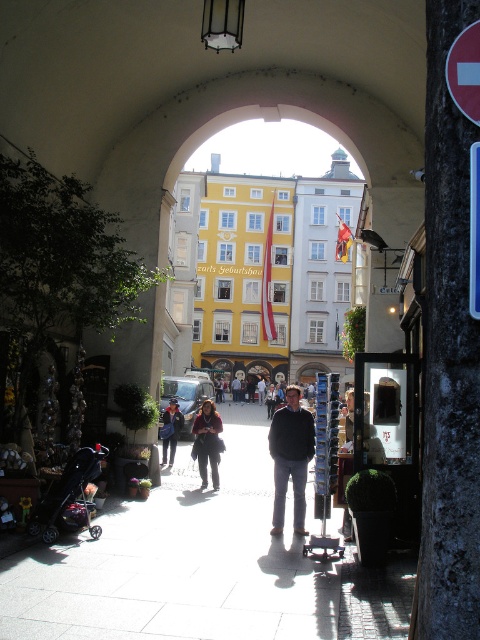
You are a photographer trying to capture a candid shot of the man in the dark gray sweater at center and the person in the denim jacket at center through the arched passageway. Since you can only focus on one subject at a time, which one should you choose to ensure the other remains visible in the background?

You should focus on the dark gray sweater at center because it is in front of the denim jacket at center, so if you focus on the front subject, the background subject will still be visible.

You are standing at the entrance of the arched passageway and see two jackets in the street below. The dark brown leather jacket at center and the denim jacket at center. Which jacket is closer to you?

The dark brown leather jacket at center is closer to the viewer than the denim jacket at center, so the dark brown leather jacket at center is closer to you.